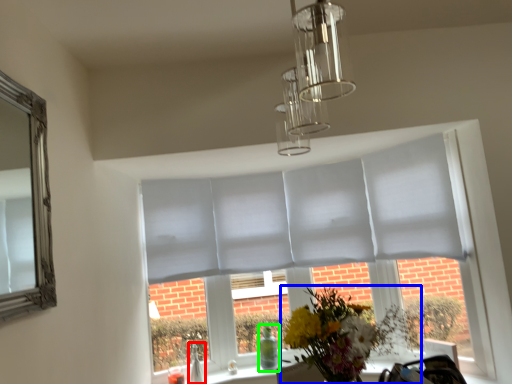
Question: Which object is positioned farthest from glass vase (highlighted by a red box)? Select from flower (highlighted by a blue box) and glass vase (highlighted by a green box).

Choices:
 (A) flower
 (B) glass vase

Answer: (A)